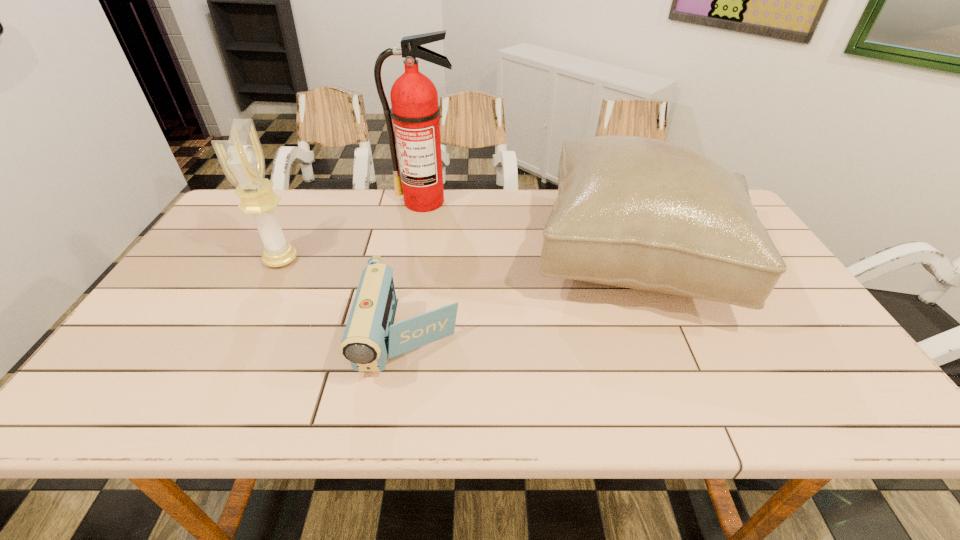
I want to click on object that stands as the closest to the leftmost object, so click(x=370, y=338).

Select which object appears as the second closest to the second shortest object. Please provide its 2D coordinates. Your answer should be formatted as a tuple, i.e. [(x, y)], where the tuple contains the x and y coordinates of a point satisfying the conditions above.

[(414, 99)]

The width and height of the screenshot is (960, 540). What are the coordinates of `blank space that satisfies the following two spatial constraints: 1. on the side of the fire extinguisher near the handle; 2. on the front-facing side of the award` in the screenshot? It's located at (415, 260).

The width and height of the screenshot is (960, 540). I want to click on blank space that satisfies the following two spatial constraints: 1. on the side of the fire extinguisher near the handle; 2. on the front-facing side of the third shortest object, so click(415, 260).

I want to click on vacant region that satisfies the following two spatial constraints: 1. on the side of the tallest object near the handle; 2. on the front-facing side of the leftmost object, so click(x=415, y=260).

Locate an element on the screen. free space that satisfies the following two spatial constraints: 1. on the back side of the rightmost object; 2. on the front-facing side of the award is located at coordinates (638, 260).

Find the location of `vacant area that satisfies the following two spatial constraints: 1. on the side of the tallest object near the handle; 2. on the front-facing side of the award`. vacant area that satisfies the following two spatial constraints: 1. on the side of the tallest object near the handle; 2. on the front-facing side of the award is located at coordinates (415, 260).

You are a GUI agent. You are given a task and a screenshot of the screen. Output one action in this format:
    pyautogui.click(x=<x>, y=<y>)
    Task: Click on the blank area in the image that satisfies the following two spatial constraints: 1. on the side of the tallest object near the handle; 2. on the right side of the third tallest object
    
    Given the screenshot: What is the action you would take?
    pyautogui.click(x=415, y=260)